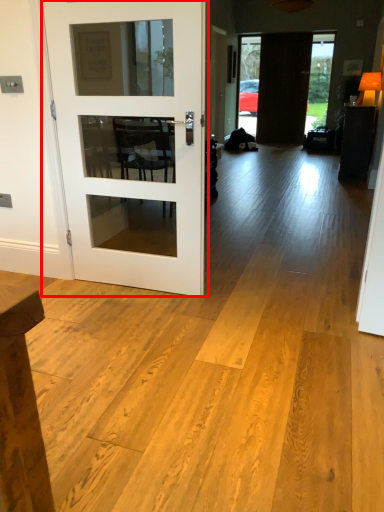
Question: Observing the image, what is the correct spatial positioning of door (annotated by the red box) in reference to door?

Choices:
 (A) right
 (B) left

Answer: (B)